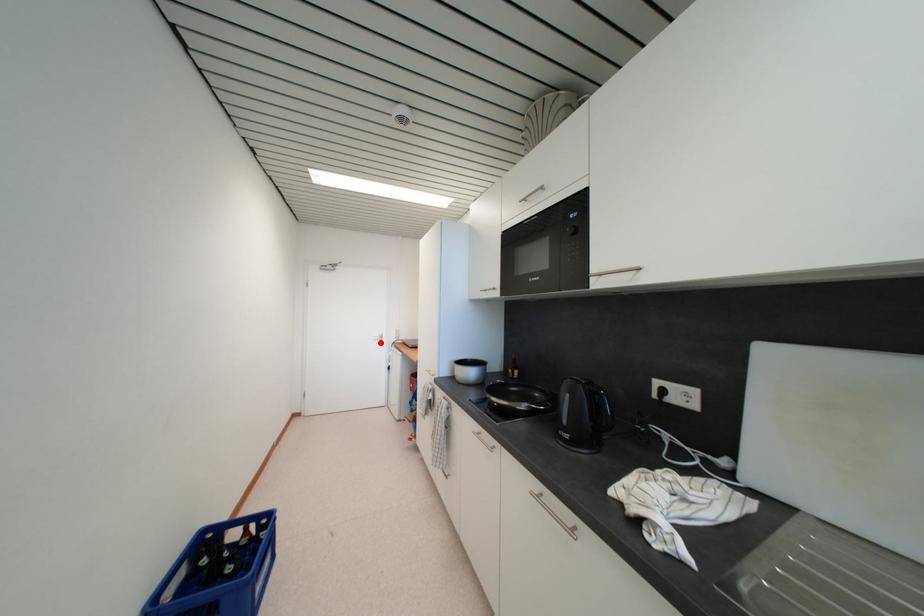
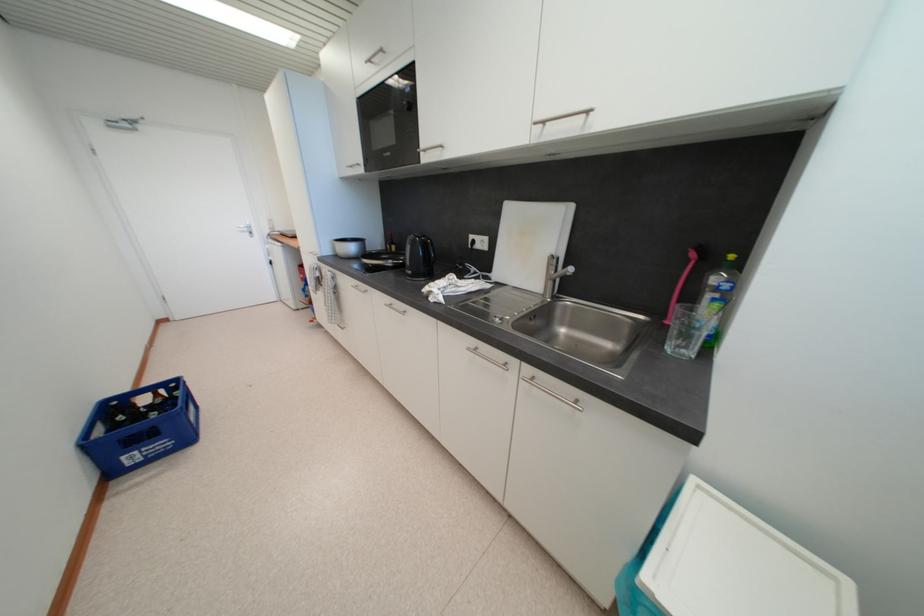
Where in the second image is the point corresponding to the highlighted location from the first image?

(248, 235)